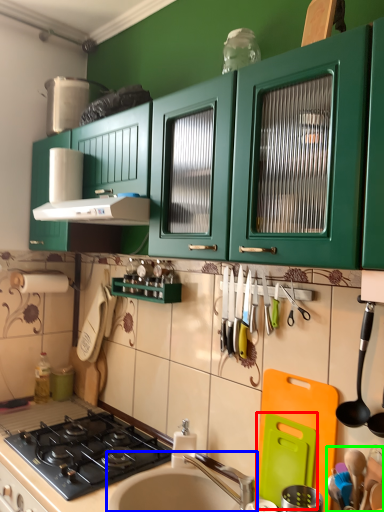
Question: Which object is the closest to the appliance (highlighted by a red box)? Choose among these: sink (highlighted by a blue box) or appliance (highlighted by a green box).

Choices:
 (A) sink
 (B) appliance

Answer: (B)